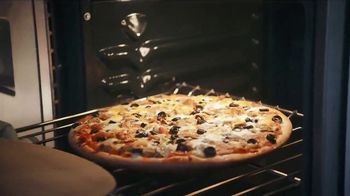
The image size is (350, 196). In order to click on pizza board in this screenshot , I will do `click(39, 180)`.